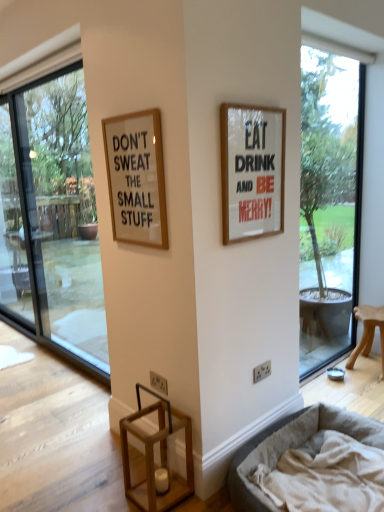
Measure the distance between wooden stool at right and camera.

A distance of 3.28 meters exists between wooden stool at right and camera.

You are a GUI agent. You are given a task and a screenshot of the screen. Output one action in this format:
    pyautogui.click(x=<x>, y=<y>)
    Task: Click on the wooden stool at right
    
    Given the screenshot: What is the action you would take?
    pyautogui.click(x=368, y=332)

In order to face transparent glass window at left, positioned as the first window in left-to-right order, should I rotate leftwards or rightwards?

To face it directly, rotate left by 17.355 degrees.

This screenshot has height=512, width=384. What do you see at coordinates (329, 203) in the screenshot?
I see `transparent glass window at right, arranged as the second window when viewed from the left` at bounding box center [329, 203].

Where is `transparent glass screen door at left`? The height and width of the screenshot is (512, 384). transparent glass screen door at left is located at coordinates (18, 231).

Is the position of gray fabric dog bed at lower right more distant than that of wooden stool at right?

No, the depth of gray fabric dog bed at lower right is less than that of wooden stool at right.

Between gray fabric dog bed at lower right and wooden stool at right, which one has smaller width?

Thinner between the two is wooden stool at right.

Is gray fabric dog bed at lower right taller than wooden stool at right?

No.

Who is taller, gray fabric dog bed at lower right or transparent glass window at right, arranged as the second window when viewed from the left?

transparent glass window at right, arranged as the second window when viewed from the left.

From a real-world perspective, which object rests below the other?

gray fabric dog bed at lower right is physically lower.

Which object is closer to the camera, gray fabric dog bed at lower right or transparent glass window at right, arranged as the second window when viewed from the left?

gray fabric dog bed at lower right is more forward.

Where is `the 2nd window positioned above the gray fabric dog bed at lower right (from a real-world perspective)`? This screenshot has height=512, width=384. the 2nd window positioned above the gray fabric dog bed at lower right (from a real-world perspective) is located at coordinates (329, 203).

Between white matte picture frame at upper right, the first picture frame in the right-to-left sequence, and gray fabric dog bed at lower right, which one has smaller size?

white matte picture frame at upper right, the first picture frame in the right-to-left sequence.

Is white matte picture frame at upper right, acting as the second picture frame starting from the left, facing away from gray fabric dog bed at lower right?

That's not correct — white matte picture frame at upper right, acting as the second picture frame starting from the left, is not looking away from gray fabric dog bed at lower right.

Who is shorter, white matte picture frame at upper right, the first picture frame in the right-to-left sequence, or gray fabric dog bed at lower right?

With less height is gray fabric dog bed at lower right.

From the image's perspective, would you say transparent glass window at right, which appears as the first window when viewed from the right, is positioned over white matte picture frame at upper right, acting as the second picture frame starting from the left?

No, from the image's perspective, transparent glass window at right, which appears as the first window when viewed from the right, is not over white matte picture frame at upper right, acting as the second picture frame starting from the left.

Is point (352, 313) farther from viewer compared to point (248, 124)?

Yes.

Is transparent glass window at right, which appears as the first window when viewed from the right, aimed at white matte picture frame at upper right, the first picture frame in the right-to-left sequence?

No, transparent glass window at right, which appears as the first window when viewed from the right, is not turned towards white matte picture frame at upper right, the first picture frame in the right-to-left sequence.

Looking at the image, does transparent glass window at right, which appears as the first window when viewed from the right, seem bigger or smaller compared to white matte picture frame at upper right, the first picture frame in the right-to-left sequence?

In the image, transparent glass window at right, which appears as the first window when viewed from the right, appears to be larger than white matte picture frame at upper right, the first picture frame in the right-to-left sequence.

Is transparent glass window at left, which is the second window in right-to-left order, turned away from wooden stool at right?

No.

Which is behind, point (41, 84) or point (371, 312)?

The point (371, 312) is more distant.

Between transparent glass window at left, which is the second window in right-to-left order, and wooden stool at right, which one appears on the right side from the viewer's perspective?

wooden stool at right.

From the image's perspective, does transparent glass window at left, positioned as the first window in left-to-right order, appear higher than wooden stool at right?

Indeed, from the image's perspective, transparent glass window at left, positioned as the first window in left-to-right order, is shown above wooden stool at right.

Locate an element on the screen. The height and width of the screenshot is (512, 384). dog bed located in front of the wooden framed signboard at left, which appears as the second picture frame when viewed from the right is located at coordinates (293, 447).

Is gray fabric dog bed at lower right at the back of wooden framed signboard at left, which appears as the second picture frame when viewed from the right?

wooden framed signboard at left, which appears as the second picture frame when viewed from the right, does not have its back to gray fabric dog bed at lower right.

Do you think wooden framed signboard at left, which appears as the second picture frame when viewed from the right, is within gray fabric dog bed at lower right, or outside of it?

wooden framed signboard at left, which appears as the second picture frame when viewed from the right, exists outside the volume of gray fabric dog bed at lower right.

Does wooden framed signboard at left, which appears as the second picture frame when viewed from the right, appear on the right side of gray fabric dog bed at lower right?

No, wooden framed signboard at left, which appears as the second picture frame when viewed from the right, is not to the right of gray fabric dog bed at lower right.

Visually, is white matte picture frame at upper right, acting as the second picture frame starting from the left, positioned to the left or to the right of wooden stool at right?

From the image, it's evident that white matte picture frame at upper right, acting as the second picture frame starting from the left, is to the left of wooden stool at right.

Is white matte picture frame at upper right, the first picture frame in the right-to-left sequence, aimed at wooden stool at right?

No, white matte picture frame at upper right, the first picture frame in the right-to-left sequence, is not turned towards wooden stool at right.

Considering the relative positions of white matte picture frame at upper right, the first picture frame in the right-to-left sequence, and wooden stool at right in the image provided, is white matte picture frame at upper right, the first picture frame in the right-to-left sequence, in front of wooden stool at right?

Yes, the depth of white matte picture frame at upper right, the first picture frame in the right-to-left sequence, is less than that of wooden stool at right.

What's the angular difference between white matte picture frame at upper right, the first picture frame in the right-to-left sequence, and wooden stool at right's facing directions?

The angle between the facing direction of white matte picture frame at upper right, the first picture frame in the right-to-left sequence, and the facing direction of wooden stool at right is 91.2 degrees.

This screenshot has width=384, height=512. What are the coordinates of `furniture that appears above the gray fabric dog bed at lower right (from a real-world perspective)` in the screenshot? It's located at (368, 332).

Find the location of a particular element. This screenshot has width=384, height=512. window located on the right of gray fabric dog bed at lower right is located at coordinates (329, 203).

Based on their spatial positions, is wooden stool at right or white matte picture frame at upper right, the first picture frame in the right-to-left sequence, closer to transparent glass window at right, arranged as the second window when viewed from the left?

wooden stool at right.

Which object lies further to the anchor point transparent glass window at right, which appears as the first window when viewed from the right, transparent glass screen door at left or gray fabric dog bed at lower right?

transparent glass screen door at left.

Based on their spatial positions, is transparent glass screen door at left or transparent glass window at right, arranged as the second window when viewed from the left, further from transparent glass window at left, positioned as the first window in left-to-right order?

Based on the image, transparent glass window at right, arranged as the second window when viewed from the left, appears to be further to transparent glass window at left, positioned as the first window in left-to-right order.

Based on the photo, when comparing their distances from wooden framed signboard at left, marked as the first picture frame in a left-to-right arrangement, does white matte picture frame at upper right, acting as the second picture frame starting from the left, or transparent glass window at left, which is the second window in right-to-left order, seem closer?

white matte picture frame at upper right, acting as the second picture frame starting from the left, is closer to wooden framed signboard at left, marked as the first picture frame in a left-to-right arrangement.

Considering their positions, is white matte picture frame at upper right, the first picture frame in the right-to-left sequence, positioned closer to transparent glass screen door at left than transparent glass window at right, arranged as the second window when viewed from the left?

Based on the image, transparent glass window at right, arranged as the second window when viewed from the left, appears to be nearer to transparent glass screen door at left.

Looking at the image, which one is located further to white matte picture frame at upper right, the first picture frame in the right-to-left sequence, wooden stool at right or transparent glass screen door at left?

Based on the image, transparent glass screen door at left appears to be further to white matte picture frame at upper right, the first picture frame in the right-to-left sequence.

Estimate the real-world distances between objects in this image. Which object is closer to transparent glass window at left, which is the second window in right-to-left order, wooden stool at right or transparent glass window at right, arranged as the second window when viewed from the left?

transparent glass window at right, arranged as the second window when viewed from the left, lies closer to transparent glass window at left, which is the second window in right-to-left order, than the other object.

Looking at the image, which one is located further to transparent glass window at right, which appears as the first window when viewed from the right, gray fabric dog bed at lower right or transparent glass screen door at left?

transparent glass screen door at left is further to transparent glass window at right, which appears as the first window when viewed from the right.

I want to click on picture frame between wooden framed signboard at left, which appears as the second picture frame when viewed from the right, and wooden stool at right from left to right, so click(x=252, y=170).

The height and width of the screenshot is (512, 384). What are the coordinates of `dog bed between transparent glass screen door at left and wooden stool at right in the horizontal direction` in the screenshot? It's located at (293, 447).

Where is `window situated between transparent glass screen door at left and white matte picture frame at upper right, acting as the second picture frame starting from the left, from left to right`? window situated between transparent glass screen door at left and white matte picture frame at upper right, acting as the second picture frame starting from the left, from left to right is located at coordinates (55, 213).

I want to click on window situated between transparent glass window at left, positioned as the first window in left-to-right order, and wooden stool at right from left to right, so click(x=329, y=203).